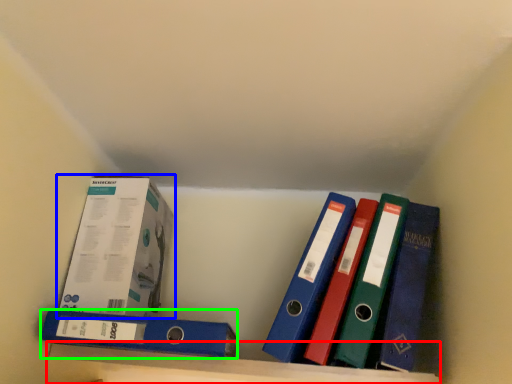
Question: Estimate the real-world distances between objects in this image. Which object is farther from shelf (highlighted by a red box), box (highlighted by a blue box) or binder (highlighted by a green box)?

Choices:
 (A) box
 (B) binder

Answer: (A)